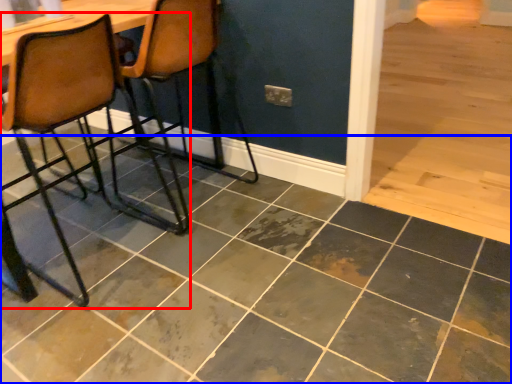
Question: Which object is closer to the camera taking this photo, chair (highlighted by a red box) or ceramic tile (highlighted by a blue box)?

Choices:
 (A) chair
 (B) ceramic tile

Answer: (B)